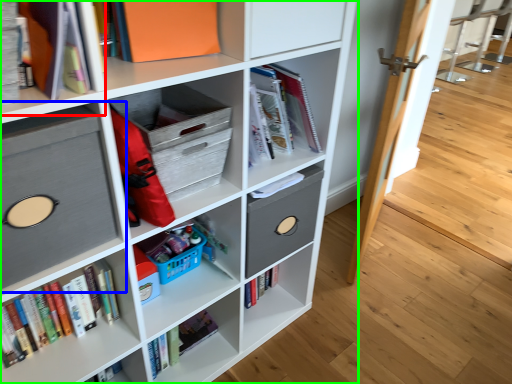
Question: Which object is the closest to the shelf (highlighted by a red box)? Choose among these: shelf (highlighted by a blue box) or shelf (highlighted by a green box).

Choices:
 (A) shelf
 (B) shelf

Answer: (A)